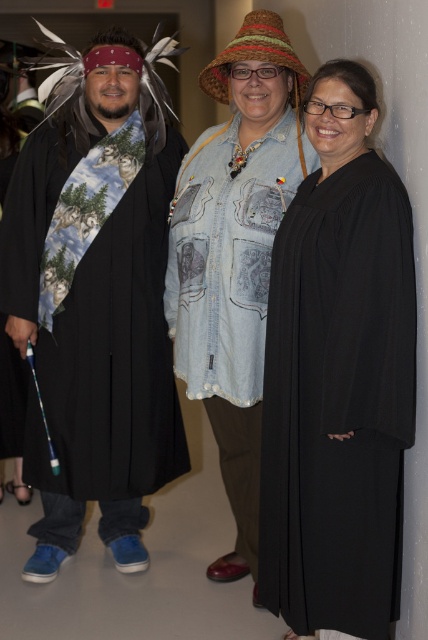
You are organizing a charity event and need to display two items from the image on a table. The black matte robe at center and the faded denim jacket at center must be placed side by side. Which item requires more table space?

The faded denim jacket at center requires more table space because the black matte robe at center occupies less space than it.

You are organizing a clothing storage space and need to determine which item requires more space. Based on the image, which item is wider between the matte black robe at left and the faded denim jacket at center?

The matte black robe at left is wider than the faded denim jacket at center, so it requires more storage space.